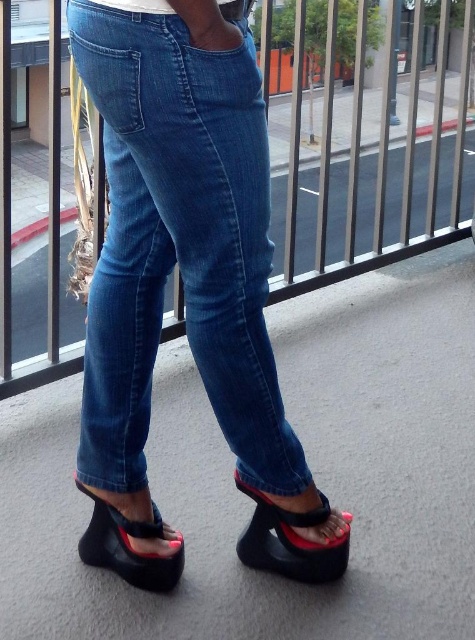
What do you see at coordinates (366, 150) in the screenshot?
I see `metallic silver rail at upper center` at bounding box center [366, 150].

Is metallic silver rail at upper center closer to camera compared to black rubber sandal at lower center?

No, metallic silver rail at upper center is behind black rubber sandal at lower center.

From the picture: Who is more forward, (x=437, y=147) or (x=257, y=566)?

Point (x=257, y=566)

Where is `metallic silver rail at upper center`? This screenshot has height=640, width=475. metallic silver rail at upper center is located at coordinates (366, 150).

The width and height of the screenshot is (475, 640). I want to click on metallic silver rail at upper center, so click(366, 150).

Find the location of a particular element. metallic silver rail at upper center is located at coordinates (366, 150).

Is black rubber sandal at lower center smaller than black rubber wedge sandal at lower left?

Incorrect, black rubber sandal at lower center is not smaller in size than black rubber wedge sandal at lower left.

Does black rubber sandal at lower center have a lesser height compared to black rubber wedge sandal at lower left?

No, black rubber sandal at lower center is not shorter than black rubber wedge sandal at lower left.

The width and height of the screenshot is (475, 640). Describe the element at coordinates (291, 540) in the screenshot. I see `black rubber sandal at lower center` at that location.

Locate an element on the screen. black rubber sandal at lower center is located at coordinates (291, 540).